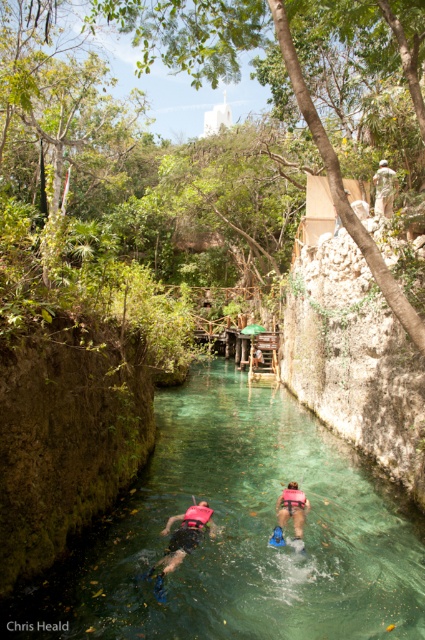
You are a safety inspector assessing the snorkeling area. You notice the pink foam vest at center and the camouflage fabric person at upper center in the water. Based on their positions, which object is positioned higher in the image?

The camouflage fabric person at upper center is positioned higher in the image than the pink foam vest at center.

You are a tour guide explaining the snorkeling area to visitors. Pointing to the image, you mention the pink foam vest at lower center and the camouflage fabric person at upper center. Which one is positioned to the left side of the other?

The pink foam vest at lower center is to the left of camouflage fabric person at upper center.